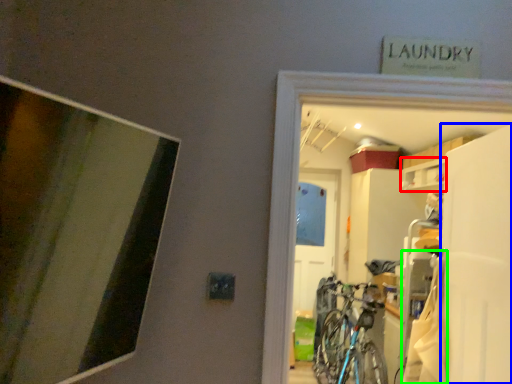
Question: Which is nearer to the cabinet (highlighted by a red box)? screen door (highlighted by a blue box) or laundry (highlighted by a green box).

Choices:
 (A) screen door
 (B) laundry

Answer: (A)